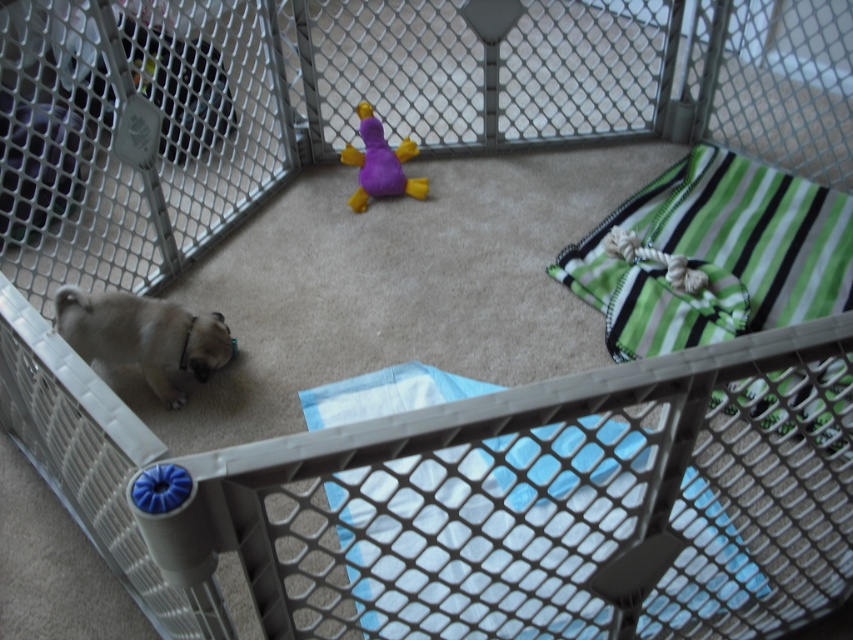
Question: Which of the following is the closest to the observer?

Choices:
 (A) (364, 166)
 (B) (187, 364)

Answer: (B)

Question: Is fuzzy beige dog at bottom left positioned before purple plush duck at center?

Choices:
 (A) no
 (B) yes

Answer: (B)

Question: Does fuzzy beige dog at bottom left appear on the left side of purple plush duck at center?

Choices:
 (A) no
 (B) yes

Answer: (B)

Question: Does fuzzy beige dog at bottom left appear on the right side of purple plush duck at center?

Choices:
 (A) no
 (B) yes

Answer: (A)

Question: Which object is closer to the camera taking this photo?

Choices:
 (A) purple plush duck at center
 (B) fuzzy beige dog at bottom left

Answer: (B)